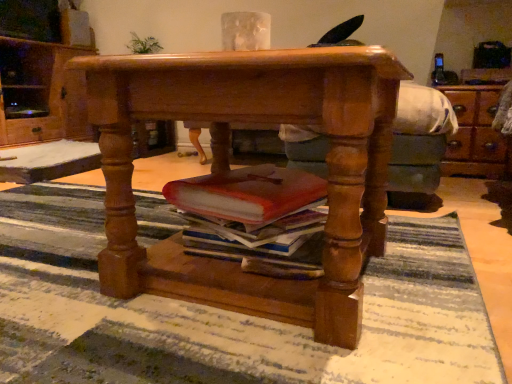
What is the approximate width of wooden cabinet at left?

wooden cabinet at left is 98.86 centimeters wide.

Describe the element at coordinates (228, 168) in the screenshot. The height and width of the screenshot is (384, 512). I see `polished wood desk at center` at that location.

In order to face striped rug at center, should I rotate leftwards or rightwards?

Rotate left and turn 17.207 degrees.

I want to click on wooden cabinet at left, so click(x=40, y=93).

Can you see polished wood desk at center touching wooden cabinet at left?

No, polished wood desk at center is not beside wooden cabinet at left.

Looking at this image, who is bigger, polished wood desk at center or wooden cabinet at left?

Bigger between the two is wooden cabinet at left.

Can you confirm if polished wood desk at center is thinner than wooden cabinet at left?

Yes.

Considering the sizes of objects wooden cabinet at left and green leafy plant at upper left in the image provided, who is bigger, wooden cabinet at left or green leafy plant at upper left?

Bigger between the two is wooden cabinet at left.

How many degrees apart are the facing directions of wooden cabinet at left and green leafy plant at upper left?

The angular difference between wooden cabinet at left and green leafy plant at upper left is 0.939 degrees.

Does wooden cabinet at left appear on the right side of green leafy plant at upper left?

No.

Is green leafy plant at upper left inside the boundaries of polished wood desk at center, or outside?

green leafy plant at upper left is located beyond the bounds of polished wood desk at center.

Consider the image. Does green leafy plant at upper left lie behind polished wood desk at center?

Yes, green leafy plant at upper left is further from the camera.

Is polished wood desk at center at the back of green leafy plant at upper left?

No.

Considering the positions of objects green leafy plant at upper left and polished wood desk at center in the image provided, who is more to the left, green leafy plant at upper left or polished wood desk at center?

Positioned to the left is green leafy plant at upper left.

Is wooden cabinet at left located outside polished wood desk at center?

Yes, wooden cabinet at left is not within polished wood desk at center.

Is wooden cabinet at left facing towards polished wood desk at center?

No.

In order to click on desk that is on the right side of wooden cabinet at left in this screenshot , I will do `click(228, 168)`.

Looking at this image, is polished wood desk at center bigger than striped rug at center?

No.

Is polished wood desk at center not inside striped rug at center?

Yes, polished wood desk at center is located beyond the bounds of striped rug at center.

Between polished wood desk at center and striped rug at center, which one is positioned behind?

polished wood desk at center.

How different are the orientations of green leafy plant at upper left and wooden cabinet at left in degrees?

green leafy plant at upper left and wooden cabinet at left are facing 0.939 degrees away from each other.

In the scene shown: Is green leafy plant at upper left surrounding wooden cabinet at left?

No, wooden cabinet at left is not inside green leafy plant at upper left.

Considering the positions of objects green leafy plant at upper left and wooden cabinet at left in the image provided, who is more to the left, green leafy plant at upper left or wooden cabinet at left?

wooden cabinet at left.

Is green leafy plant at upper left touching wooden cabinet at left?

No, green leafy plant at upper left is not beside wooden cabinet at left.

Is striped rug at center placed right next to polished wood desk at center?

There is a gap between striped rug at center and polished wood desk at center.

Is striped rug at center positioned before polished wood desk at center?

Yes, striped rug at center is closer to the viewer.

How distant is striped rug at center from polished wood desk at center?

The distance of striped rug at center from polished wood desk at center is 8.67 inches.

Find the location of a particular element. The height and width of the screenshot is (384, 512). cabinetry that appears above the polished wood desk at center (from a real-world perspective) is located at coordinates (40, 93).

Locate an element on the screen. cabinetry that is in front of the green leafy plant at upper left is located at coordinates (40, 93).

From the image, which object appears to be farther from wooden cabinet at left, green leafy plant at upper left or striped rug at center?

Based on the image, striped rug at center appears to be further to wooden cabinet at left.

Looking at the image, which one is located closer to wooden cabinet at left, striped rug at center or green leafy plant at upper left?

The object closer to wooden cabinet at left is green leafy plant at upper left.

When comparing their distances from green leafy plant at upper left, does striped rug at center or polished wood desk at center seem closer?

striped rug at center lies closer to green leafy plant at upper left than the other object.

Looking at this image, estimate the real-world distances between objects in this image. Which object is closer to striped rug at center, green leafy plant at upper left or wooden cabinet at left?

Among the two, wooden cabinet at left is located nearer to striped rug at center.

Based on the photo, from the image, which object appears to be nearer to green leafy plant at upper left, wooden cabinet at left or polished wood desk at center?

wooden cabinet at left is closer to green leafy plant at upper left.

Based on their spatial positions, is striped rug at center or wooden cabinet at left closer to green leafy plant at upper left?

Based on the image, wooden cabinet at left appears to be nearer to green leafy plant at upper left.

Looking at the image, which one is located closer to striped rug at center, polished wood desk at center or green leafy plant at upper left?

polished wood desk at center is positioned closer to the anchor striped rug at center.

Looking at the image, which one is located closer to polished wood desk at center, wooden cabinet at left or striped rug at center?

Among the two, striped rug at center is located nearer to polished wood desk at center.

I want to click on cabinetry between striped rug at center and green leafy plant at upper left from front to back, so click(x=40, y=93).

Find the location of a particular element. The width and height of the screenshot is (512, 384). desk positioned between striped rug at center and green leafy plant at upper left from near to far is located at coordinates (228, 168).

Find the location of `cabinetry between polished wood desk at center and green leafy plant at upper left from front to back`. cabinetry between polished wood desk at center and green leafy plant at upper left from front to back is located at coordinates click(x=40, y=93).

The image size is (512, 384). I want to click on desk located between striped rug at center and wooden cabinet at left in the depth direction, so click(x=228, y=168).